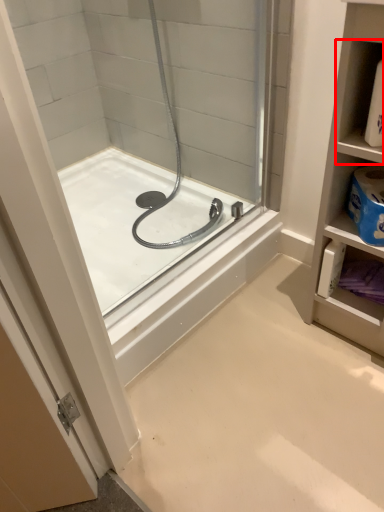
Question: From the image's perspective, what is the correct spatial positioning of shelf (annotated by the red box) in reference to bathtub?

Choices:
 (A) above
 (B) below

Answer: (A)